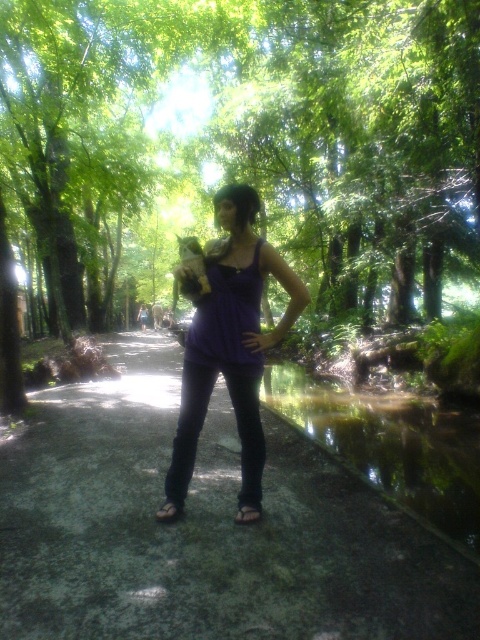
Question: Is purple matte tank top at center smaller than black leather sandal at lower center?

Choices:
 (A) no
 (B) yes

Answer: (A)

Question: Does green concrete path at center appear on the right side of purple matte tank top at center?

Choices:
 (A) yes
 (B) no

Answer: (A)

Question: Which point is closer to the camera?

Choices:
 (A) purple matte tank top at center
 (B) brown leather sandal at lower center

Answer: (A)

Question: Can you confirm if green concrete path at center is bigger than purple matte tank top at center?

Choices:
 (A) yes
 (B) no

Answer: (B)

Question: Which of the following is the farthest from the observer?

Choices:
 (A) (253, 212)
 (B) (247, 524)
 (C) (207, 582)
 (D) (273, 154)

Answer: (D)

Question: Which object is positioned farthest from the green concrete path at center?

Choices:
 (A) green leafy tree at center
 (B) black leather sandal at lower center

Answer: (A)